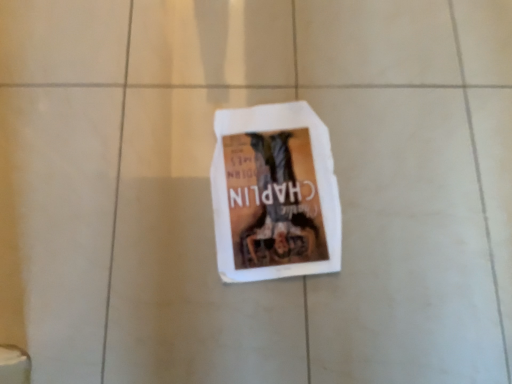
Identify the location of free point above white paper at center (from a real-world perspective). This screenshot has width=512, height=384. (274, 185).